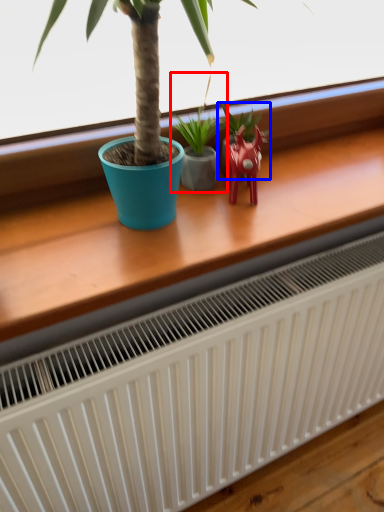
Question: Which object is further to the camera taking this photo, houseplant (highlighted by a red box) or houseplant (highlighted by a blue box)?

Choices:
 (A) houseplant
 (B) houseplant

Answer: (B)